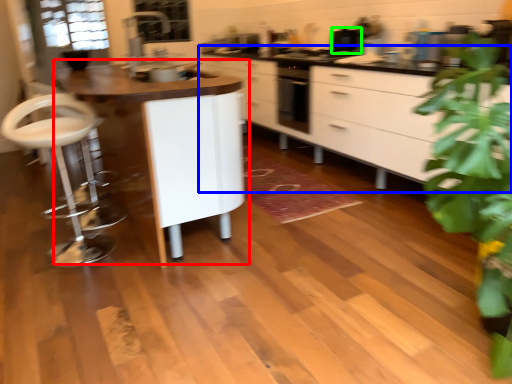
Question: Considering the real-world distances, which object is closest to table (highlighted by a red box)? cabinetry (highlighted by a blue box) or appliance (highlighted by a green box).

Choices:
 (A) cabinetry
 (B) appliance

Answer: (A)